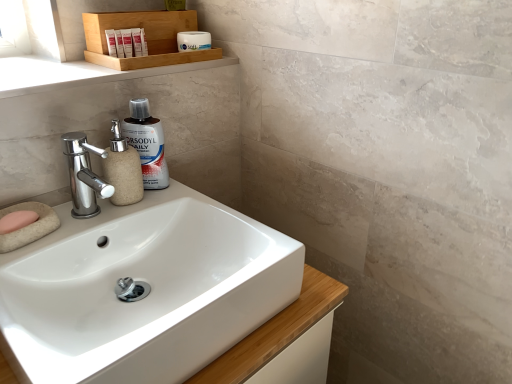
Question: Should I look upward or downward to see wooden tray at upper center?

Choices:
 (A) down
 (B) up

Answer: (B)

Question: Is beige textured soap dispenser at left not inside white glossy sink at center?

Choices:
 (A) no
 (B) yes

Answer: (A)

Question: Is beige textured soap dispenser at left thinner than white glossy sink at center?

Choices:
 (A) no
 (B) yes

Answer: (B)

Question: From the image's perspective, is beige textured soap dispenser at left on white glossy sink at center?

Choices:
 (A) yes
 (B) no

Answer: (A)

Question: Is beige textured soap dispenser at left taller than white glossy sink at center?

Choices:
 (A) no
 (B) yes

Answer: (A)

Question: Could you tell me if beige textured soap dispenser at left is facing white glossy sink at center?

Choices:
 (A) yes
 (B) no

Answer: (A)

Question: From a real-world perspective, does beige textured soap dispenser at left stand above white glossy sink at center?

Choices:
 (A) yes
 (B) no

Answer: (A)

Question: From a real-world perspective, is beige marble tray at upper left below pink sponge at lower left?

Choices:
 (A) yes
 (B) no

Answer: (B)

Question: Can you confirm if beige marble tray at upper left is bigger than pink sponge at lower left?

Choices:
 (A) no
 (B) yes

Answer: (B)

Question: Is beige marble tray at upper left looking in the opposite direction of pink sponge at lower left?

Choices:
 (A) yes
 (B) no

Answer: (B)

Question: Can you confirm if beige marble tray at upper left is thinner than pink sponge at lower left?

Choices:
 (A) no
 (B) yes

Answer: (A)

Question: Is beige marble tray at upper left oriented towards pink sponge at lower left?

Choices:
 (A) yes
 (B) no

Answer: (B)

Question: Considering the relative sizes of beige marble tray at upper left and pink sponge at lower left in the image provided, is beige marble tray at upper left smaller than pink sponge at lower left?

Choices:
 (A) no
 (B) yes

Answer: (A)

Question: Is white matte tube at upper center, placed as the second toiletry when sorted from right to left, thinner than matte white tube at upper left, marked as the third toiletry in a back-to-front arrangement?

Choices:
 (A) yes
 (B) no

Answer: (B)